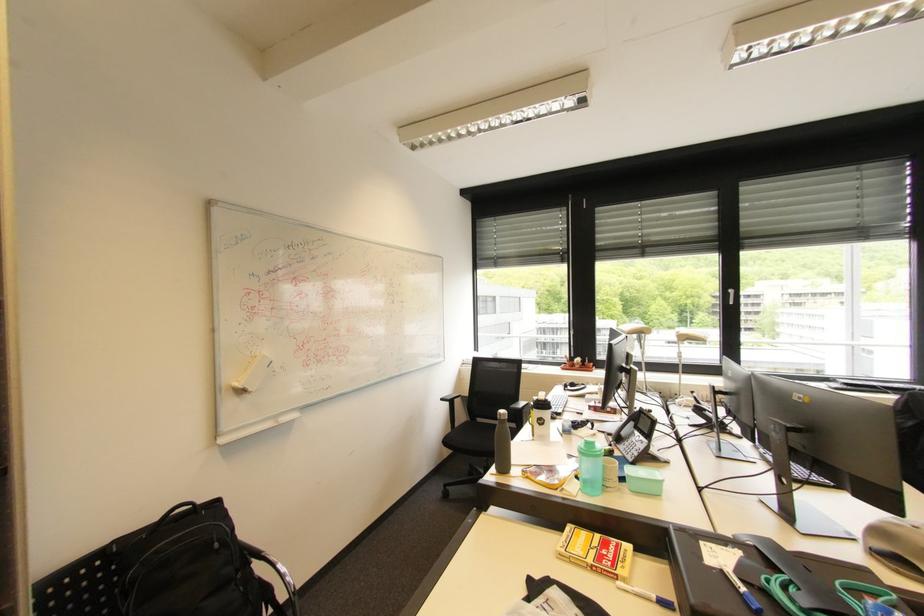
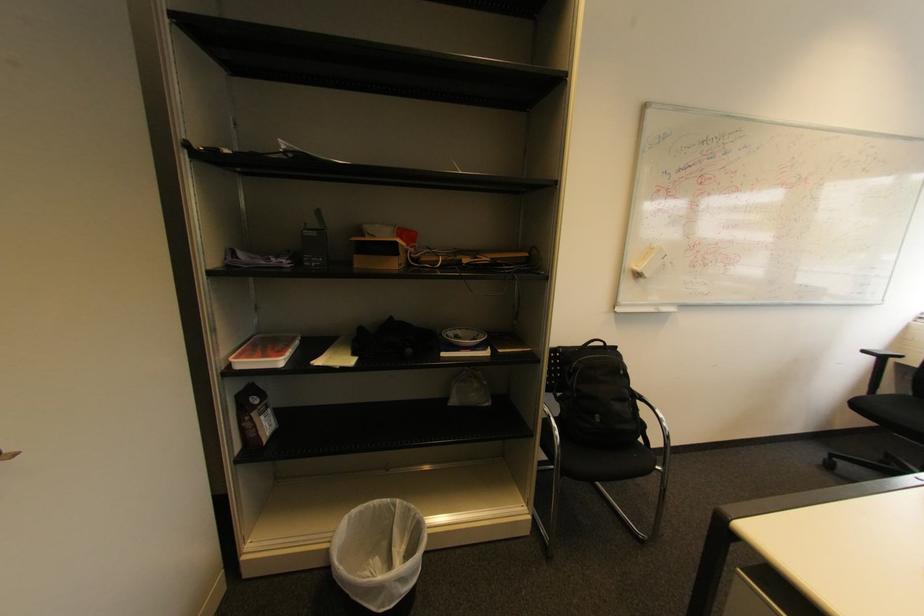
The point at (446, 400) is marked in the first image. Where is the corresponding point in the second image?

(869, 352)